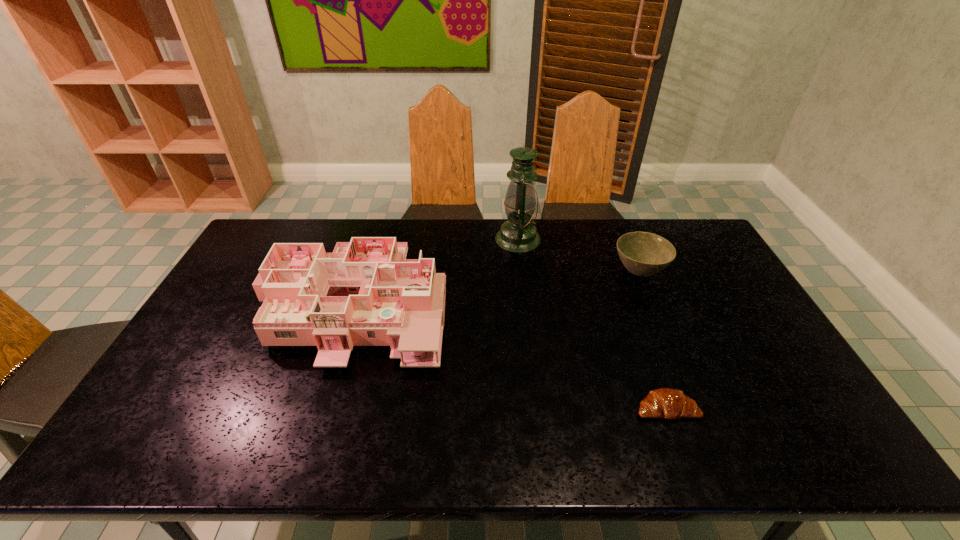
Where is `free space that satisfies the following two spatial constraints: 1. at the front entrance of the third shortest object; 2. on the right side of the crescent roll`? free space that satisfies the following two spatial constraints: 1. at the front entrance of the third shortest object; 2. on the right side of the crescent roll is located at coordinates (324, 409).

You are a GUI agent. You are given a task and a screenshot of the screen. Output one action in this format:
    pyautogui.click(x=<x>, y=<y>)
    Task: Click on the free spot that satisfies the following two spatial constraints: 1. on the front side of the farthest object; 2. on the left side of the nearest object
    The image size is (960, 540).
    Given the screenshot: What is the action you would take?
    pyautogui.click(x=537, y=409)